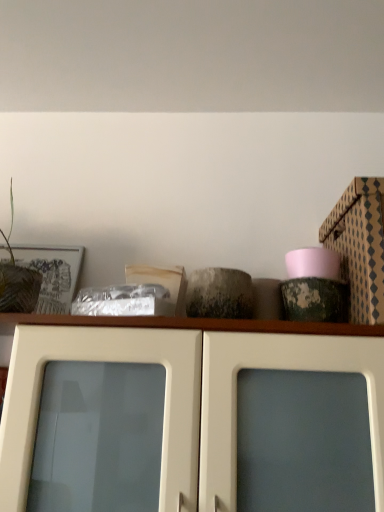
Question: Does patterned cardboard box at upper right turn towards green leafy plant at left?

Choices:
 (A) yes
 (B) no

Answer: (B)

Question: From the image's perspective, does patterned cardboard box at upper right appear higher than green leafy plant at left?

Choices:
 (A) no
 (B) yes

Answer: (A)

Question: Does patterned cardboard box at upper right contain green leafy plant at left?

Choices:
 (A) no
 (B) yes

Answer: (A)

Question: Considering the relative sizes of patterned cardboard box at upper right and green leafy plant at left in the image provided, is patterned cardboard box at upper right smaller than green leafy plant at left?

Choices:
 (A) yes
 (B) no

Answer: (B)

Question: Is patterned cardboard box at upper right turned away from green leafy plant at left?

Choices:
 (A) yes
 (B) no

Answer: (B)

Question: From the image's perspective, is white glossy cabinet doors at center positioned above or below green leafy plant at left?

Choices:
 (A) above
 (B) below

Answer: (B)

Question: In terms of size, does white glossy cabinet doors at center appear bigger or smaller than green leafy plant at left?

Choices:
 (A) big
 (B) small

Answer: (A)

Question: Is white glossy cabinet doors at center wider or thinner than green leafy plant at left?

Choices:
 (A) wide
 (B) thin

Answer: (A)

Question: Relative to green leafy plant at left, is white glossy cabinet doors at center in front or behind?

Choices:
 (A) front
 (B) behind

Answer: (A)

Question: Based on their sizes in the image, would you say green leafy plant at left is bigger or smaller than white glossy cabinet doors at center?

Choices:
 (A) small
 (B) big

Answer: (A)

Question: Would you say green leafy plant at left is to the left or to the right of white glossy cabinet doors at center in the picture?

Choices:
 (A) left
 (B) right

Answer: (A)

Question: Is green leafy plant at left in front of or behind white glossy cabinet doors at center in the image?

Choices:
 (A) front
 (B) behind

Answer: (B)

Question: Looking at their shapes, would you say green leafy plant at left is wider or thinner than white glossy cabinet doors at center?

Choices:
 (A) thin
 (B) wide

Answer: (A)

Question: Is white glossy cabinet doors at center bigger or smaller than patterned cardboard box at upper right?

Choices:
 (A) small
 (B) big

Answer: (B)

Question: Is white glossy cabinet doors at center inside or outside of patterned cardboard box at upper right?

Choices:
 (A) inside
 (B) outside

Answer: (B)